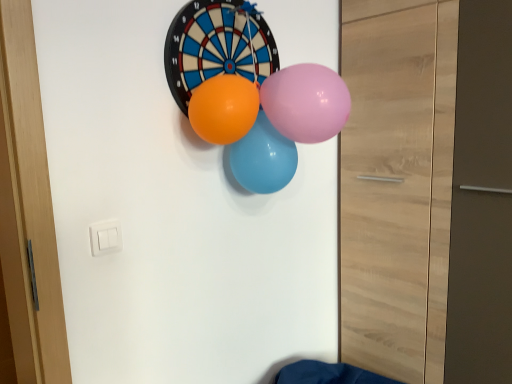
Question: From the image's perspective, is pink glossy balloon at center, the 1th balloon in the front-to-back sequence, below orange rubber balloon at center, the 2th balloon viewed from the back?

Choices:
 (A) no
 (B) yes

Answer: (A)

Question: Does pink glossy balloon at center, the third balloon in the back-to-front sequence, lie behind orange rubber balloon at center, which is counted as the second balloon, starting from the front?

Choices:
 (A) no
 (B) yes

Answer: (A)

Question: Considering the relative sizes of pink glossy balloon at center, the 1th balloon in the front-to-back sequence, and orange rubber balloon at center, which is counted as the second balloon, starting from the front, in the image provided, is pink glossy balloon at center, the 1th balloon in the front-to-back sequence, shorter than orange rubber balloon at center, which is counted as the second balloon, starting from the front,?

Choices:
 (A) yes
 (B) no

Answer: (B)

Question: Is pink glossy balloon at center, the 1th balloon in the front-to-back sequence, looking in the opposite direction of orange rubber balloon at center, the 2th balloon viewed from the back?

Choices:
 (A) yes
 (B) no

Answer: (B)

Question: Is pink glossy balloon at center, the third balloon in the back-to-front sequence, positioned far away from orange rubber balloon at center, which is counted as the second balloon, starting from the front?

Choices:
 (A) no
 (B) yes

Answer: (A)

Question: In terms of height, does pink glossy balloon at center, the third balloon in the back-to-front sequence, look taller or shorter compared to matte blue balloon at center, which appears as the 1th balloon when viewed from the back?

Choices:
 (A) tall
 (B) short

Answer: (B)

Question: Is pink glossy balloon at center, the third balloon in the back-to-front sequence, spatially inside matte blue balloon at center, acting as the 3th balloon starting from the front, or outside of it?

Choices:
 (A) outside
 (B) inside

Answer: (A)

Question: Considering the positions of pink glossy balloon at center, the third balloon in the back-to-front sequence, and matte blue balloon at center, which appears as the 1th balloon when viewed from the back, in the image, is pink glossy balloon at center, the third balloon in the back-to-front sequence, wider or thinner than matte blue balloon at center, which appears as the 1th balloon when viewed from the back,?

Choices:
 (A) thin
 (B) wide

Answer: (B)

Question: In terms of size, does pink glossy balloon at center, the third balloon in the back-to-front sequence, appear bigger or smaller than matte blue balloon at center, acting as the 3th balloon starting from the front?

Choices:
 (A) big
 (B) small

Answer: (B)

Question: Looking at their shapes, would you say matte blue balloon at center, which appears as the 1th balloon when viewed from the back, is wider or thinner than orange rubber balloon at center, the 2th balloon viewed from the back?

Choices:
 (A) thin
 (B) wide

Answer: (A)

Question: Would you say matte blue balloon at center, which appears as the 1th balloon when viewed from the back, is inside or outside orange rubber balloon at center, the 2th balloon viewed from the back?

Choices:
 (A) outside
 (B) inside

Answer: (A)

Question: Looking at the image, does matte blue balloon at center, which appears as the 1th balloon when viewed from the back, seem bigger or smaller compared to orange rubber balloon at center, the 2th balloon viewed from the back?

Choices:
 (A) small
 (B) big

Answer: (B)

Question: From the image's perspective, is matte blue balloon at center, acting as the 3th balloon starting from the front, located above or below orange rubber balloon at center, which is counted as the second balloon, starting from the front?

Choices:
 (A) above
 (B) below

Answer: (B)

Question: Considering the positions of pink glossy balloon at center, the 1th balloon in the front-to-back sequence, and orange rubber balloon at center, which is counted as the second balloon, starting from the front, in the image, is pink glossy balloon at center, the 1th balloon in the front-to-back sequence, taller or shorter than orange rubber balloon at center, which is counted as the second balloon, starting from the front,?

Choices:
 (A) tall
 (B) short

Answer: (A)

Question: Considering the positions of pink glossy balloon at center, the 1th balloon in the front-to-back sequence, and orange rubber balloon at center, the 2th balloon viewed from the back, in the image, is pink glossy balloon at center, the 1th balloon in the front-to-back sequence, wider or thinner than orange rubber balloon at center, the 2th balloon viewed from the back,?

Choices:
 (A) thin
 (B) wide

Answer: (B)